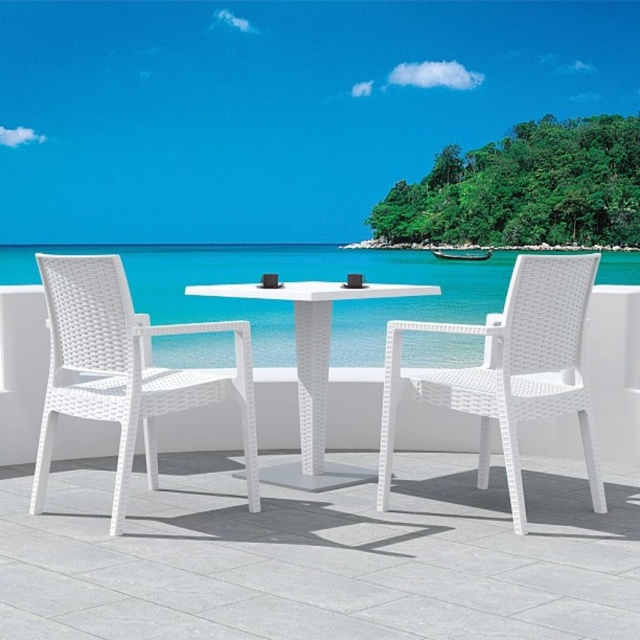
You are standing at the edge of the patio looking towards the white table at center. There is a point marked at coordinates point (x=508, y=371). What object is located at that point?

The point (x=508, y=371) marks the location of the white wicker chair at center.

Consider the image. You are standing on the patio and want to place a small potted plant between the two points marked as point (52, 289) and point (326, 305). Which point should the plant be closer to in order to be nearer to the viewer?

The plant should be closer to point (52, 289) because it is nearer to the viewer compared to point (326, 305).